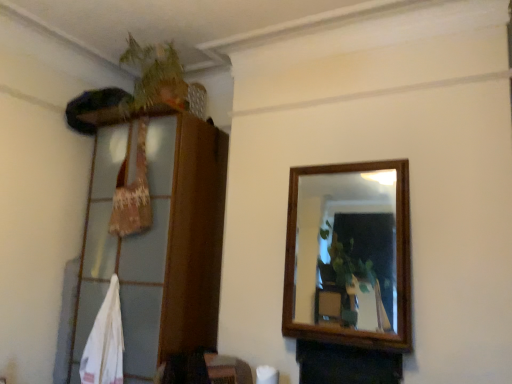
Where is `green leafy plant at upper left`? The width and height of the screenshot is (512, 384). green leafy plant at upper left is located at coordinates (156, 76).

Image resolution: width=512 pixels, height=384 pixels. What do you see at coordinates (156, 76) in the screenshot?
I see `green leafy plant at upper left` at bounding box center [156, 76].

This screenshot has height=384, width=512. What are the coordinates of `wooden dresser at left` in the screenshot? It's located at (155, 239).

The height and width of the screenshot is (384, 512). What do you see at coordinates (155, 239) in the screenshot? I see `wooden dresser at left` at bounding box center [155, 239].

The height and width of the screenshot is (384, 512). I want to click on green leafy plant at upper left, so click(x=156, y=76).

Would you say wooden dresser at left is to the left or to the right of green leafy plant at upper left in the picture?

From the image, it's evident that wooden dresser at left is to the left of green leafy plant at upper left.

Is wooden dresser at left positioned in front of green leafy plant at upper left?

That is True.

Does point (74, 319) lie behind point (156, 47)?

That is False.

From the image's perspective, which one is positioned lower, wooden dresser at left or green leafy plant at upper left?

wooden dresser at left appears lower in the image.

From a real-world perspective, is wooden dresser at left positioned above or below green leafy plant at upper left?

In terms of real-world spatial position, wooden dresser at left is below green leafy plant at upper left.

Considering the sizes of wooden dresser at left and green leafy plant at upper left in the image, is wooden dresser at left wider or thinner than green leafy plant at upper left?

In the image, wooden dresser at left appears to be wider than green leafy plant at upper left.

Does wooden dresser at left have a greater height compared to green leafy plant at upper left?

Indeed, wooden dresser at left has a greater height compared to green leafy plant at upper left.

Between wooden dresser at left and green leafy plant at upper left, which one has larger size?

Bigger between the two is wooden dresser at left.

Choose the correct answer: Is wooden dresser at left inside green leafy plant at upper left or outside it?

The correct answer is: outside.

Would you consider wooden dresser at left to be distant from green leafy plant at upper left?

No, there isn't a large distance between wooden dresser at left and green leafy plant at upper left.

Could you tell me if wooden dresser at left is turned towards green leafy plant at upper left?

No, wooden dresser at left is not oriented towards green leafy plant at upper left.

How far apart are wooden dresser at left and green leafy plant at upper left?

A distance of 26.36 inches exists between wooden dresser at left and green leafy plant at upper left.

This screenshot has width=512, height=384. In the image, there is a green leafy plant at upper left. Identify the location of dresser below it (from a real-world perspective). (155, 239).

Which is more to the right, green leafy plant at upper left or wooden dresser at left?

green leafy plant at upper left.

Considering the relative positions of green leafy plant at upper left and wooden dresser at left in the image provided, is green leafy plant at upper left in front of wooden dresser at left?

No, it is not.

Does point (153, 90) come in front of point (90, 118)?

Yes, it is in front of point (90, 118).

From the image's perspective, which is below, green leafy plant at upper left or wooden dresser at left?

wooden dresser at left is shown below in the image.

From a real-world perspective, is green leafy plant at upper left below wooden dresser at left?

No, from a real-world perspective, green leafy plant at upper left is not beneath wooden dresser at left.

Is green leafy plant at upper left wider than wooden dresser at left?

In fact, green leafy plant at upper left might be narrower than wooden dresser at left.

Who is taller, green leafy plant at upper left or wooden dresser at left?

Standing taller between the two is wooden dresser at left.

Can you confirm if green leafy plant at upper left is smaller than wooden dresser at left?

Indeed, green leafy plant at upper left has a smaller size compared to wooden dresser at left.

Is green leafy plant at upper left not inside wooden dresser at left?

Absolutely, green leafy plant at upper left is external to wooden dresser at left.

Is green leafy plant at upper left beside wooden dresser at left?

green leafy plant at upper left is not next to wooden dresser at left, and they're not touching.

Does green leafy plant at upper left turn towards wooden dresser at left?

No, green leafy plant at upper left is not oriented towards wooden dresser at left.

What's the angular difference between green leafy plant at upper left and wooden dresser at left's facing directions?

green leafy plant at upper left and wooden dresser at left are facing 88.6 degrees away from each other.

What are the coordinates of `plant on the right of wooden dresser at left` in the screenshot? It's located at (156, 76).

This screenshot has width=512, height=384. Identify the location of plant above the wooden dresser at left (from a real-world perspective). (156, 76).

Locate an element on the screen. plant above the wooden dresser at left (from the image's perspective) is located at coordinates (x=156, y=76).